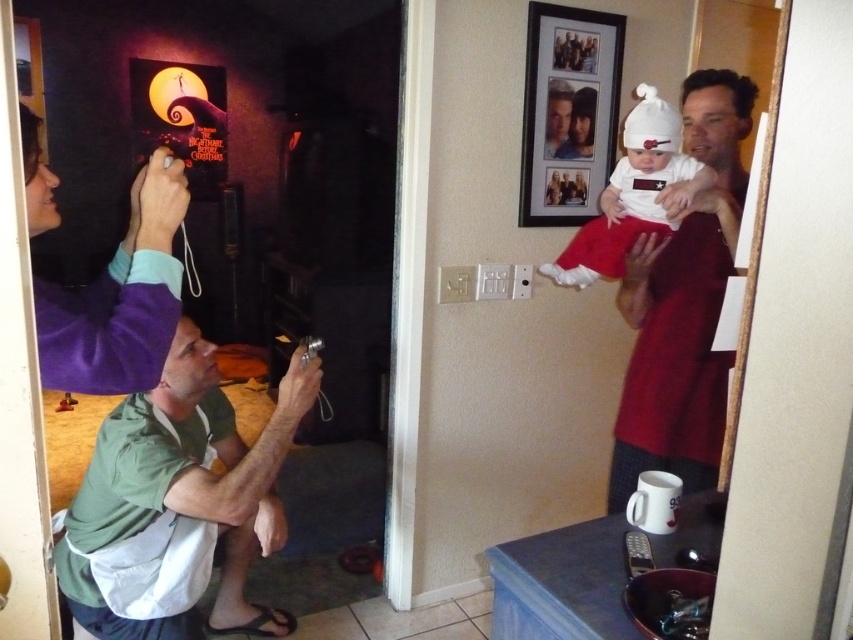
You are standing in the scene and want to hang a picture frame that is 1 meter tall on the wall. The wooden framed photo at upper center is currently occupying the spot where you want to hang it. Can the matte red shirt at right be moved to make space for the new frame?

The matte red shirt at right is much taller than the wooden framed photo at upper center. Moving the matte red shirt at right would free up enough space to hang the 1 meter tall frame since it occupies more vertical space.

You are standing in the room and want to place a small plant between the matte red shirt at right and the wooden framed photo at upper center. Based on their positions, which object should the plant be closer to?

The matte red shirt at right is positioned under the wooden framed photo at upper center, so the plant should be placed closer to the matte red shirt at right since it is located below the photo.

You are standing in the room and want to hand a gift to the person wearing the matte red shirt at right. Based on their position, where should you walk to in order to reach them?

The matte red shirt at right is located at point 0.478 on the x axis and 0.802 on the y axis, so you should walk towards the coordinates (x=683, y=305) to reach them.